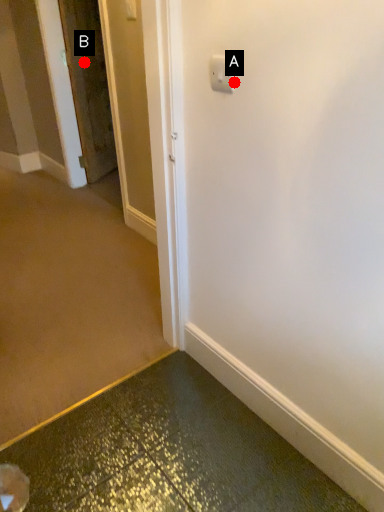
Question: Two points are circled on the image, labeled by A and B beside each circle. Among these points, which one is nearest to the camera?

Choices:
 (A) A is closer
 (B) B is closer

Answer: (A)